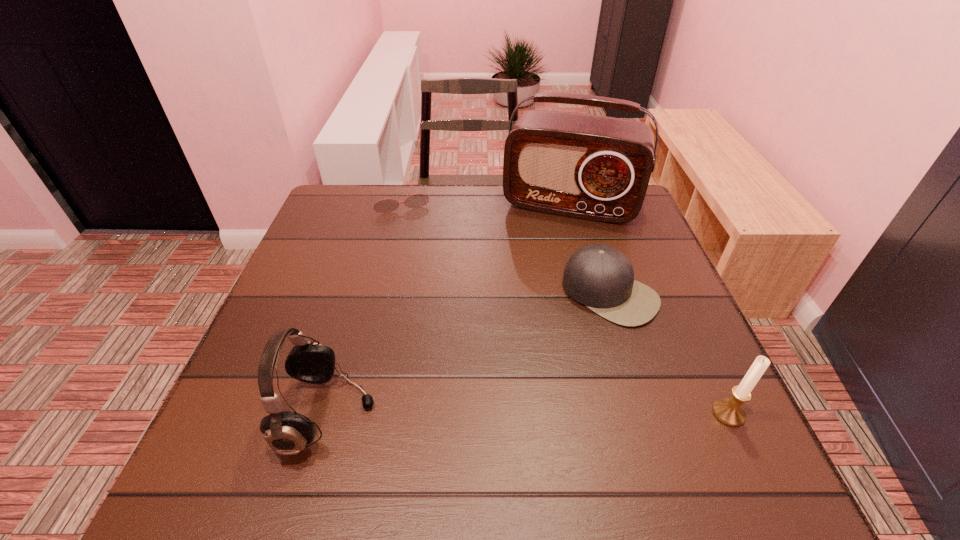
Locate an element on the screen. free space on the desktop that is between the headset and the third tallest object and is positioned on the brim of the third nearest object is located at coordinates (504, 414).

Image resolution: width=960 pixels, height=540 pixels. I want to click on vacant space on the desktop that is between the headset and the candle holder and is positioned on the front panel of the radio receiver, so click(513, 414).

Locate an element on the screen. vacant spot on the desktop that is between the second tallest object and the third tallest object and is positioned on the face of the sunglasses is located at coordinates (470, 414).